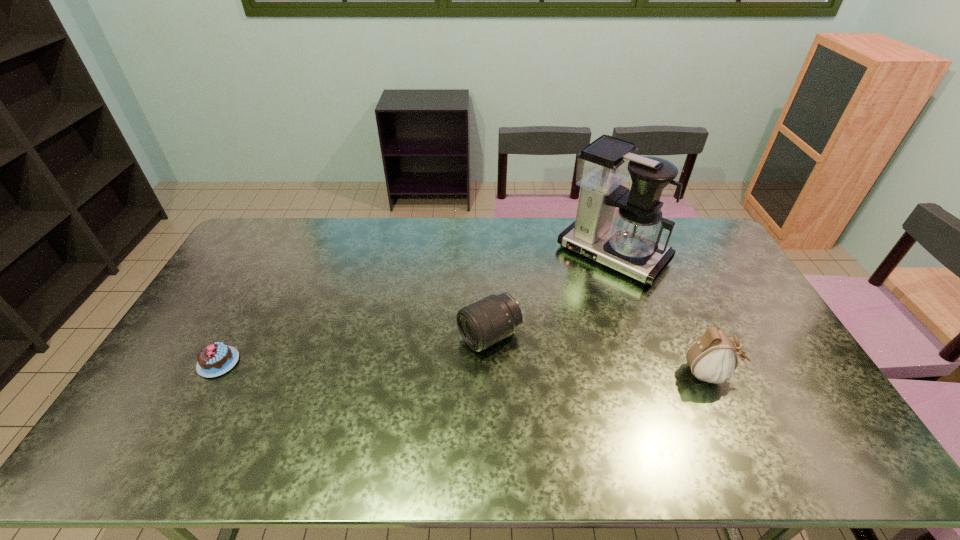
You are a GUI agent. You are given a task and a screenshot of the screen. Output one action in this format:
    pyautogui.click(x=<x>, y=<y>)
    Task: Click on the leftmost object
    The image size is (960, 540).
    Given the screenshot: What is the action you would take?
    pyautogui.click(x=215, y=359)

Locate an element on the screen. Image resolution: width=960 pixels, height=540 pixels. the shortest object is located at coordinates (215, 359).

Identify the location of pouch. This screenshot has height=540, width=960. pyautogui.click(x=712, y=357).

Where is `the farthest object`? The height and width of the screenshot is (540, 960). the farthest object is located at coordinates (630, 244).

In order to click on coffee maker in this screenshot , I will do `click(630, 244)`.

What are the coordinates of `telephoto lens` in the screenshot? It's located at pyautogui.click(x=481, y=324).

Identify the location of the second shortest object. Image resolution: width=960 pixels, height=540 pixels. (481, 324).

Where is `vacant space situated on the back of the chocolate cake`? The height and width of the screenshot is (540, 960). vacant space situated on the back of the chocolate cake is located at coordinates (273, 262).

Locate an element on the screen. free space located 0.180m on the front-facing side of the pouch is located at coordinates (801, 374).

I want to click on vacant space situated 0.160m at the front of the coffee maker where the controls are located, so click(x=560, y=307).